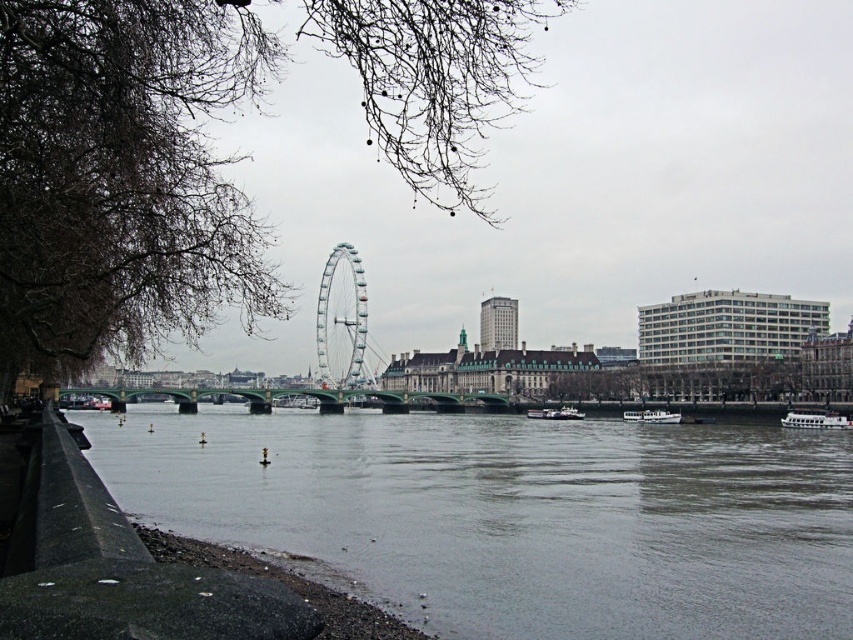
Question: Is white glossy boat at lower right positioned before white plastic boat at center?

Choices:
 (A) yes
 (B) no

Answer: (A)

Question: Estimate the real-world distances between objects in this image. Which object is closer to the shiny metallic ferris wheel at center?

Choices:
 (A) white glossy boat at lower right
 (B) white glossy boat at center
 (C) white plastic boat at center

Answer: (C)

Question: Can you confirm if shiny metallic ferris wheel at center is thinner than white glossy boat at lower right?

Choices:
 (A) yes
 (B) no

Answer: (B)

Question: Which point is farther to the camera?

Choices:
 (A) (798, 426)
 (B) (798, 573)
 (C) (364, 307)

Answer: (C)

Question: Does gray concrete river at lower center have a larger size compared to shiny metallic ferris wheel at center?

Choices:
 (A) yes
 (B) no

Answer: (A)

Question: Which point is closer to the camera?

Choices:
 (A) (346, 262)
 (B) (566, 417)
 (C) (715, 499)

Answer: (C)